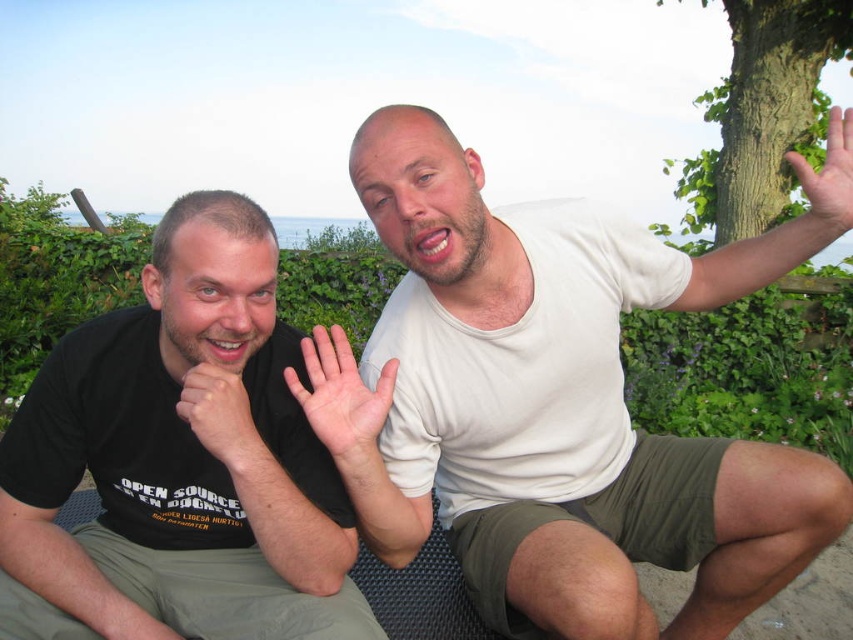
Question: In this image, where is white matte shirt at upper center located relative to matte black hand at lower left?

Choices:
 (A) right
 (B) left

Answer: (A)

Question: Does black matte shirt at left have a larger size compared to matte black hand at lower left?

Choices:
 (A) no
 (B) yes

Answer: (B)

Question: Which object is farther from the camera taking this photo?

Choices:
 (A) light brown skin at upper right
 (B) black matte shirt at left
 (C) matte black hand at lower left
 (D) white matte shirt at upper center

Answer: (A)

Question: Does light skin smooth hand at center appear over light brown skin at upper right?

Choices:
 (A) no
 (B) yes

Answer: (A)

Question: Which point is closer to the camera taking this photo?

Choices:
 (A) (225, 451)
 (B) (347, 353)
 (C) (828, 115)

Answer: (A)

Question: Which object is closer to the camera taking this photo?

Choices:
 (A) black matte shirt at left
 (B) white matte shirt at upper center
 (C) light brown skin at upper right
 (D) light skin smooth hand at center

Answer: (A)